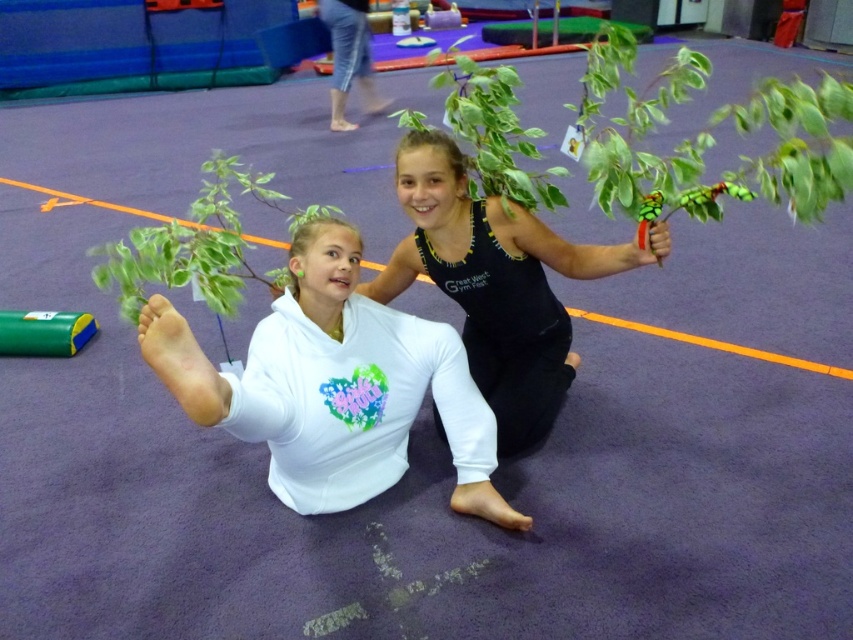
You are a photographer standing in front of the two girls on the mat. You want to take a photo that includes both girls but focuses on the one closer to you. Which girl should you focus on, the one at point (532,282) or the one at point (556,168)?

You should focus on the girl at point (532,282) because it is closer to you than the girl at point (556,168).

You are a photographer setting up a shoot in the gymnastics facility. You need to ensure that the black matte tank top at center is visible in the frame. Given that the green glossy plant at center is blocking part of it, how can you adjust your position to capture both objects without obstruction?

Move the camera slightly upward so that the green glossy plant at center is no longer blocking the black matte tank top at center, as the black matte tank top at center is positioned under the green glossy plant at center.